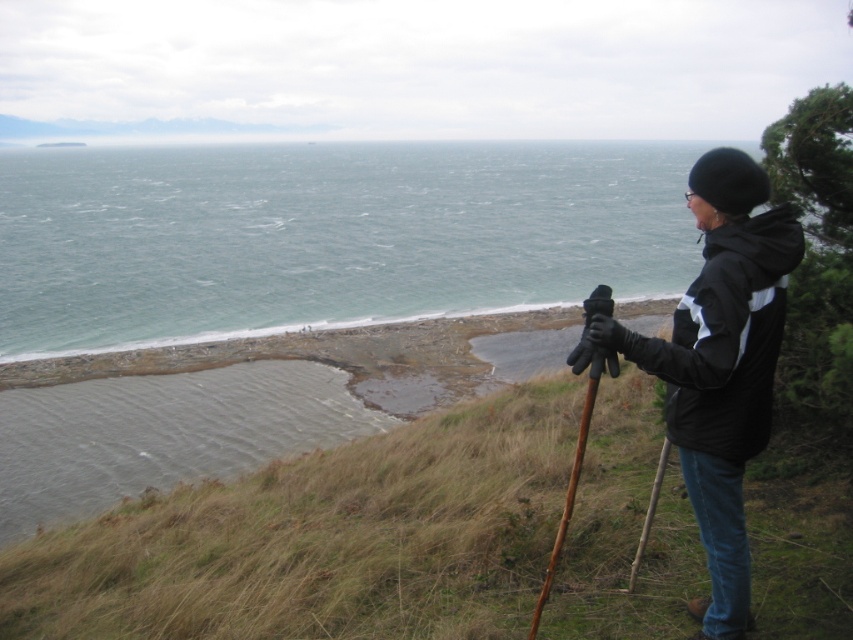
Question: Which object appears farthest from the camera in this image?

Choices:
 (A) black matte jacket at center right
 (B) green grassy at lower left

Answer: (B)

Question: Which of the following is the closest to the observer?

Choices:
 (A) blue-green water at center
 (B) black matte jacket at center right

Answer: (B)

Question: Estimate the real-world distances between objects in this image. Which object is farther from the black matte jacket at center right?

Choices:
 (A) blue-green water at center
 (B) green grassy at lower left

Answer: (A)

Question: Is blue-green water at center positioned behind black matte jacket at center right?

Choices:
 (A) no
 (B) yes

Answer: (B)

Question: Is blue-green water at center below black matte jacket at center right?

Choices:
 (A) yes
 (B) no

Answer: (B)

Question: Is blue-green water at center below black matte jacket at center right?

Choices:
 (A) no
 (B) yes

Answer: (A)